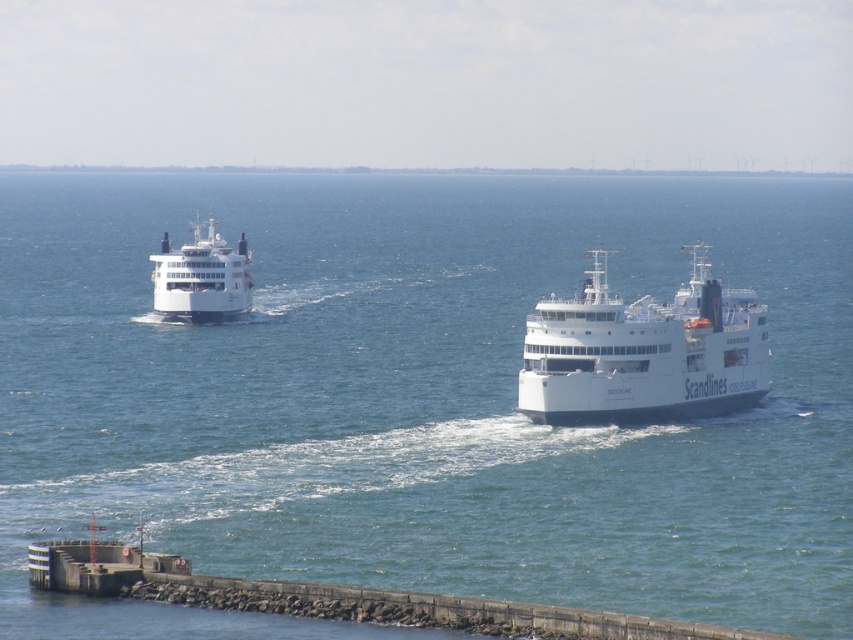
You are an observer standing on the jetty and looking at the blue water at center and the white matte ferry at left. Which one appears taller from your perspective?

The blue water at center appears taller than the white matte ferry at left from your perspective.

You are a photographer trying to capture the white matte ferry at left and the blue water at center in a single shot. Which object occupies more horizontal space in the image?

The blue water at center occupies more horizontal space than the white matte ferry at left because its width surpasses the ferry.

You are a passenger on the white matte ferry at center and want to wave to someone on the white matte ferry at left. Can you see them clearly from your current position?

The white matte ferry at center is in front of the white matte ferry at left, so you can see them clearly from your current position.